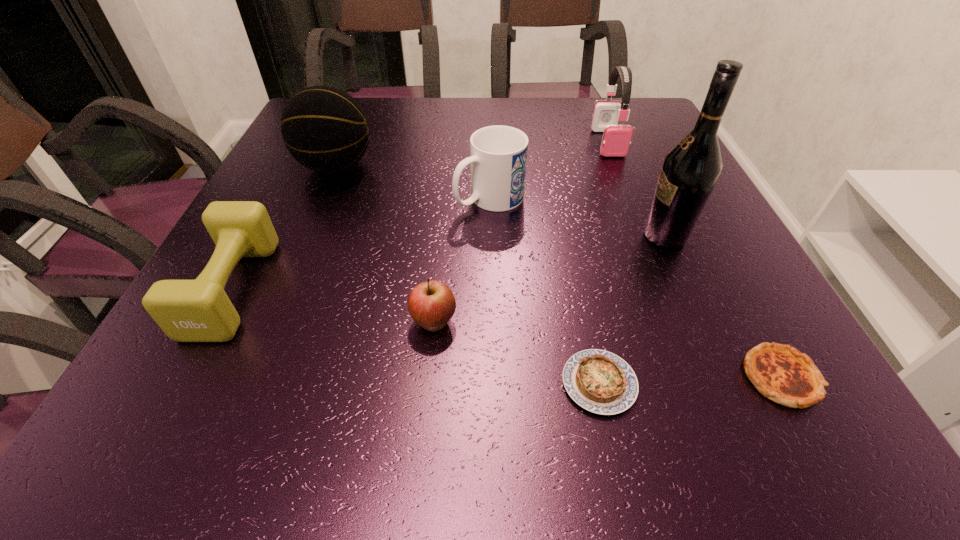
Image resolution: width=960 pixels, height=540 pixels. What are the coordinates of `free point between the wine bottle and the earphone` in the screenshot? It's located at (636, 190).

Choose which object is the sixth nearest neighbor to the basketball. Please provide its 2D coordinates. Your answer should be formatted as a tuple, i.e. [(x, y)], where the tuple contains the x and y coordinates of a point satisfying the conditions above.

[(690, 170)]

The width and height of the screenshot is (960, 540). Identify the location of object that stands as the third closest to the shorter quiche. (690, 170).

The image size is (960, 540). What are the coordinates of `vacant position in the image that satisfies the following two spatial constraints: 1. on the label of the tallest object; 2. on the front side of the fourth object from right to left` in the screenshot? It's located at (731, 383).

Find the location of a particular element. The width and height of the screenshot is (960, 540). free space that satisfies the following two spatial constraints: 1. on the back side of the right quiche; 2. on the left side of the left quiche is located at coordinates [x=598, y=378].